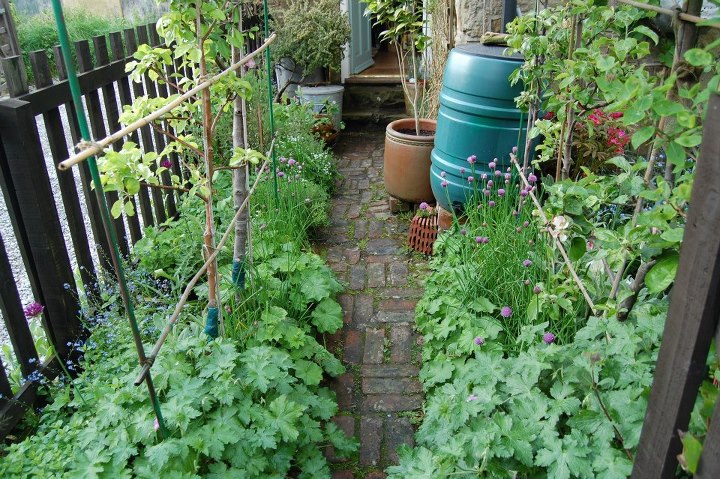
This screenshot has width=720, height=479. What are the coordinates of `pink flowers on the right` in the screenshot? It's located at (600, 121), (613, 127), (615, 138).